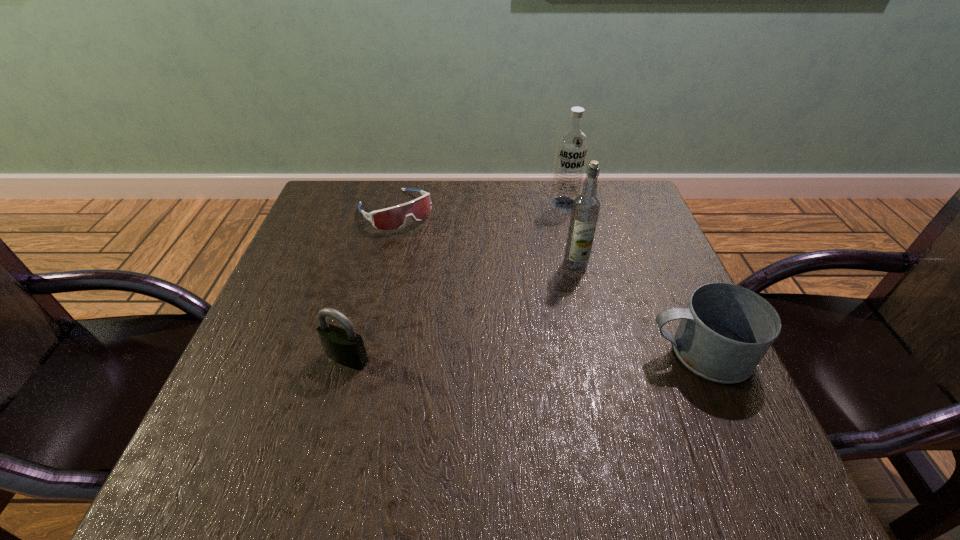
Where is `free spot at the far left corner of the desktop`? This screenshot has width=960, height=540. free spot at the far left corner of the desktop is located at coordinates (321, 228).

Locate an element on the screen. The width and height of the screenshot is (960, 540). free space at the near left corner of the desktop is located at coordinates (252, 396).

The height and width of the screenshot is (540, 960). Identify the location of vacant space at the far right corner. (643, 217).

Find the location of `vacant space at the near right corner of the desktop`. vacant space at the near right corner of the desktop is located at coordinates pyautogui.click(x=738, y=403).

This screenshot has height=540, width=960. Identify the location of vacant area that lies between the padlock and the farther vodka. (455, 281).

Identify the location of free spot between the goggles and the farther vodka. The image size is (960, 540). (479, 207).

Find the location of `unoccupied position between the goggles and the rightmost object`. unoccupied position between the goggles and the rightmost object is located at coordinates (547, 281).

Find the location of `free space between the farther vodka and the goggles`. free space between the farther vodka and the goggles is located at coordinates (479, 207).

Find the location of a particular element. free space between the padlock and the nearer vodka is located at coordinates (461, 312).

Identify the location of unoccupied area between the padlock and the goggles. (372, 284).